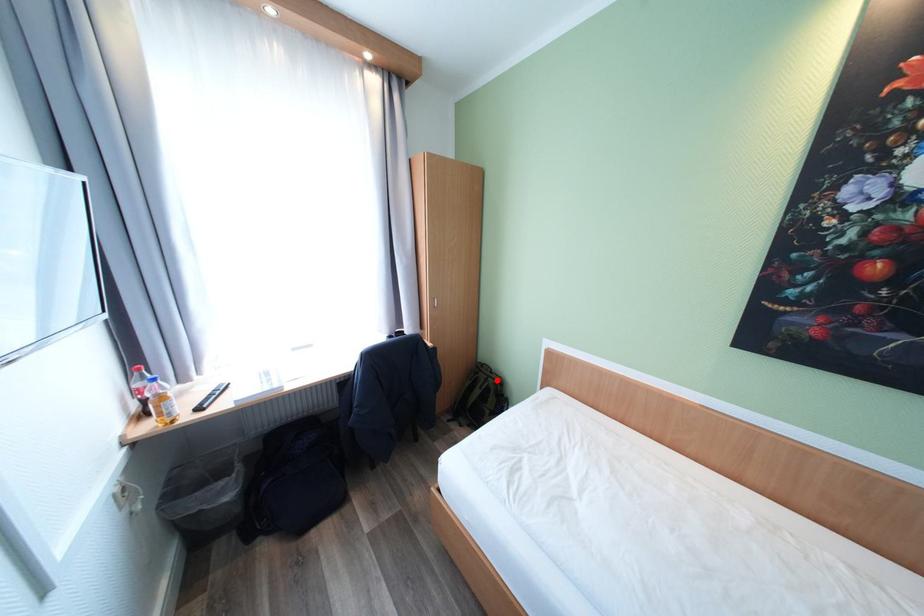
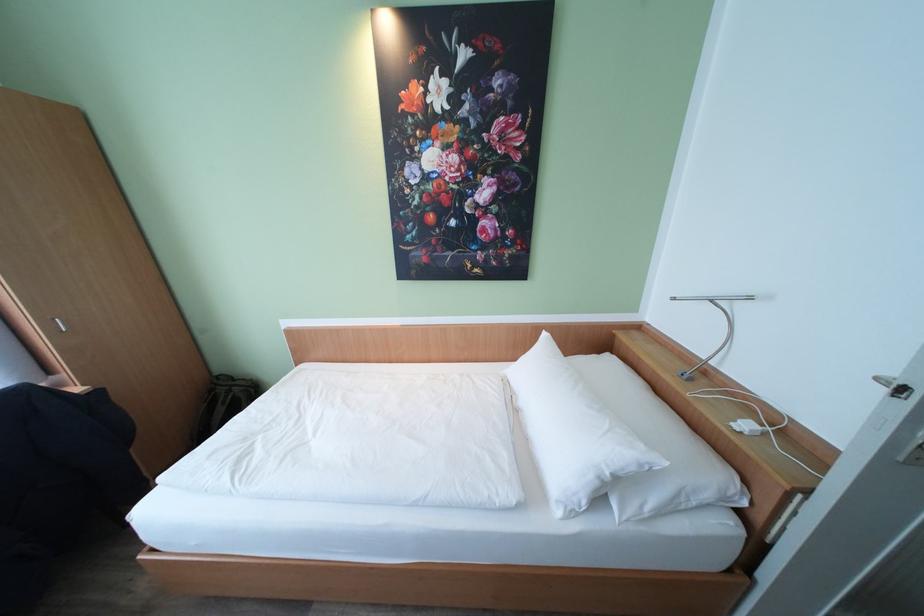
Locate, in the second image, the point that corresponds to the highlighted location in the first image.

(241, 389)